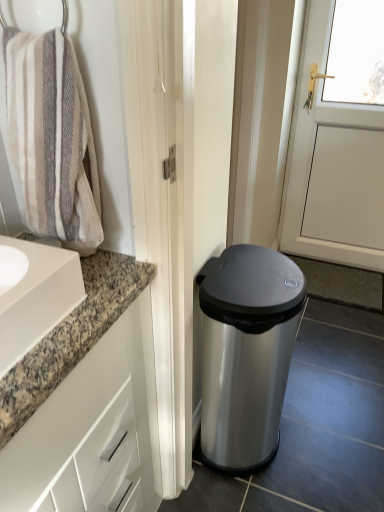
Question: Considering the positions of beige textured towel at left and satin silver trash can at lower right in the image, is beige textured towel at left taller or shorter than satin silver trash can at lower right?

Choices:
 (A) short
 (B) tall

Answer: (A)

Question: Relative to satin silver trash can at lower right, is beige textured towel at left in front or behind?

Choices:
 (A) front
 (B) behind

Answer: (A)

Question: Which of these objects is positioned farthest from the beige textured towel at left?

Choices:
 (A) white glossy cabinet at left
 (B) satin silver trash can at lower right

Answer: (B)

Question: Estimate the real-world distances between objects in this image. Which object is farther from the beige textured towel at left?

Choices:
 (A) satin silver trash can at lower right
 (B) white glossy cabinet at left

Answer: (A)